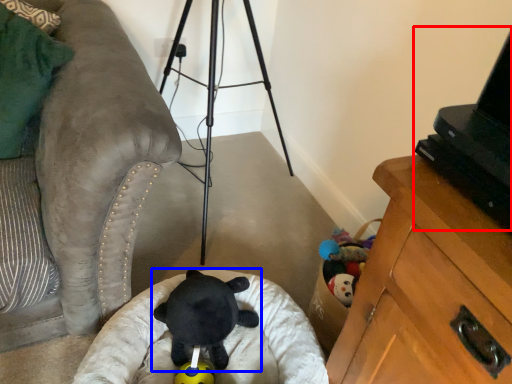
Question: Among these objects, which one is nearest to the camera, computer (highlighted by a red box) or toy (highlighted by a blue box)?

Choices:
 (A) computer
 (B) toy

Answer: (A)